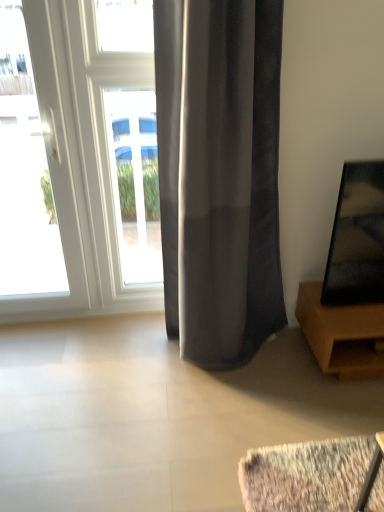
Where is `vacant space situated on the left part of satin gray curtain at center`? This screenshot has height=512, width=384. vacant space situated on the left part of satin gray curtain at center is located at coordinates (129, 365).